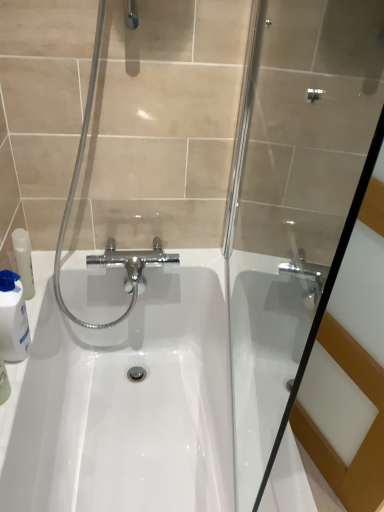
Question: Does white glossy sink at center have a lesser width compared to transparent glass shower door at center?

Choices:
 (A) yes
 (B) no

Answer: (B)

Question: Is white glossy sink at center to the right of transparent glass shower door at center from the viewer's perspective?

Choices:
 (A) no
 (B) yes

Answer: (A)

Question: Is there a large distance between white glossy sink at center and transparent glass shower door at center?

Choices:
 (A) no
 (B) yes

Answer: (A)

Question: Is white glossy sink at center bigger than transparent glass shower door at center?

Choices:
 (A) yes
 (B) no

Answer: (A)

Question: Does white glossy sink at center have a greater height compared to transparent glass shower door at center?

Choices:
 (A) yes
 (B) no

Answer: (B)

Question: Is white glossy sink at center outside transparent glass shower door at center?

Choices:
 (A) yes
 (B) no

Answer: (A)

Question: Considering the relative positions of transparent glass shower door at center and white glossy bottle at left in the image provided, is transparent glass shower door at center behind white glossy bottle at left?

Choices:
 (A) yes
 (B) no

Answer: (B)

Question: Considering the relative positions of transparent glass shower door at center and white glossy bottle at left in the image provided, is transparent glass shower door at center to the right of white glossy bottle at left from the viewer's perspective?

Choices:
 (A) no
 (B) yes

Answer: (B)

Question: Does transparent glass shower door at center appear on the left side of white glossy bottle at left?

Choices:
 (A) yes
 (B) no

Answer: (B)

Question: Can you confirm if transparent glass shower door at center is thinner than white glossy bottle at left?

Choices:
 (A) yes
 (B) no

Answer: (A)

Question: Could you tell me if transparent glass shower door at center is turned towards white glossy bottle at left?

Choices:
 (A) yes
 (B) no

Answer: (B)

Question: Is transparent glass shower door at center in contact with white glossy bottle at left?

Choices:
 (A) no
 (B) yes

Answer: (A)

Question: Are white glossy sink at center and white glossy bottle at left beside each other?

Choices:
 (A) yes
 (B) no

Answer: (B)